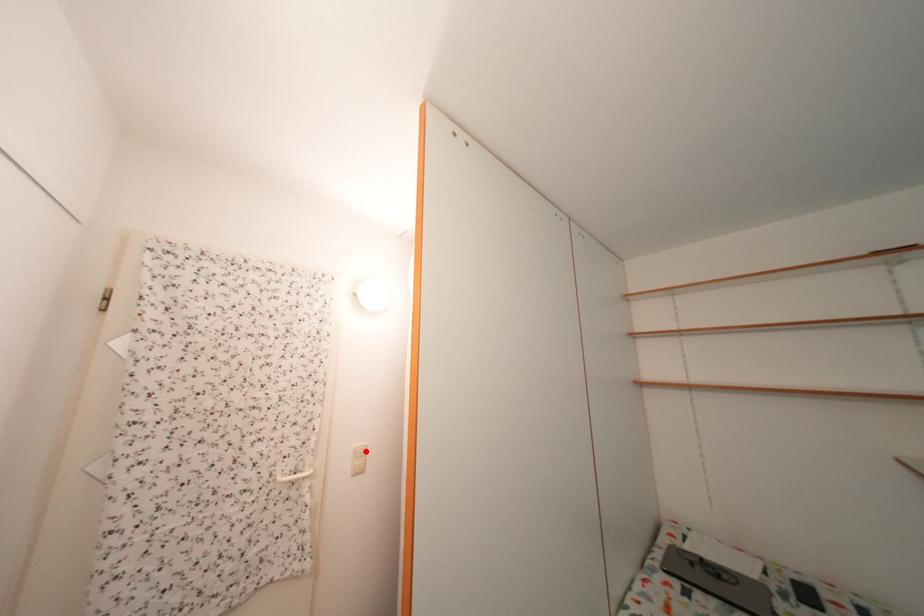
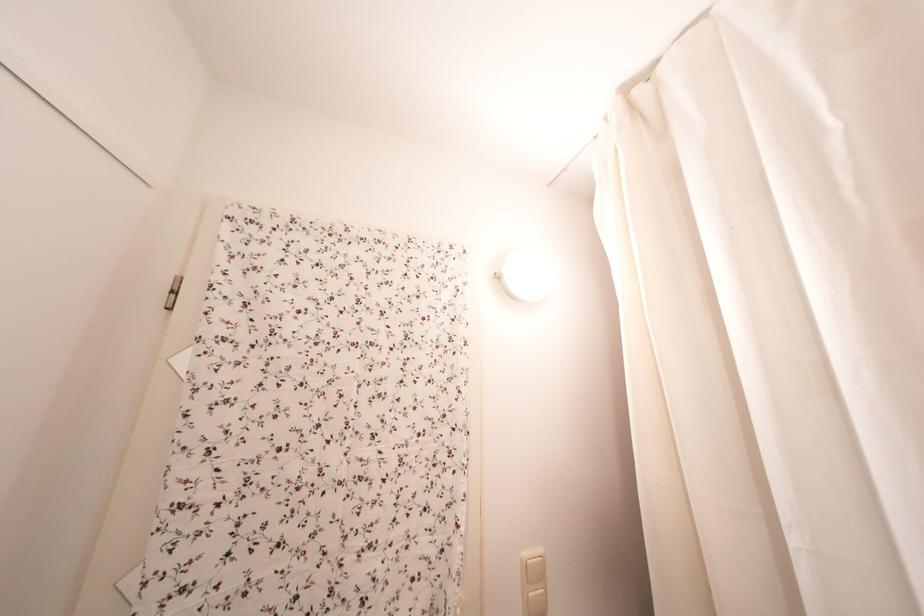
Question: I am providing you with two images of the same scene from different viewpoints. A red point is marked on the first image. Can you still see the location of the red point in image 2?

Choices:
 (A) Yes
 (B) No

Answer: (A)